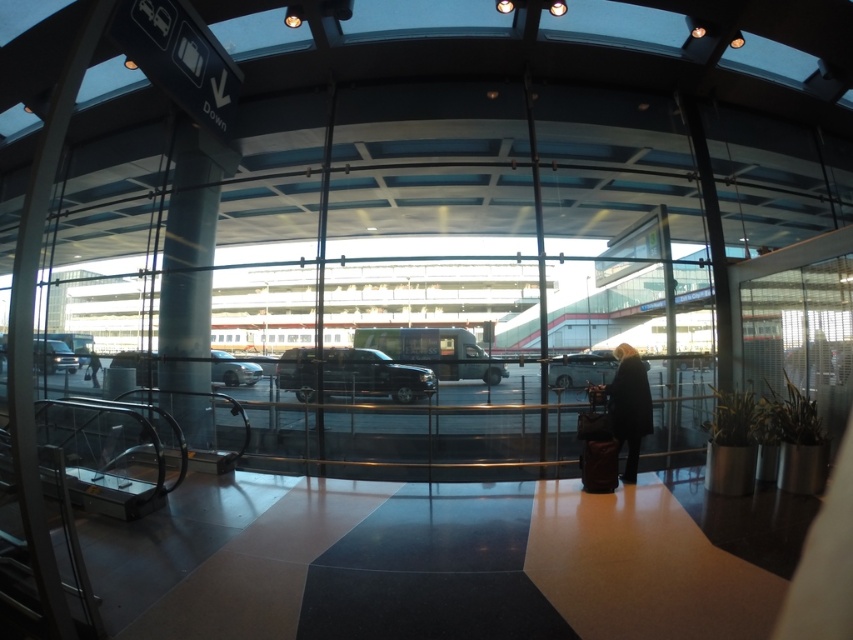
How far apart are metallic silver van at center and metallic silver van at left?

metallic silver van at center is 36.23 feet away from metallic silver van at left.

Does metallic silver van at center have a larger size compared to metallic silver van at left?

Indeed, metallic silver van at center has a larger size compared to metallic silver van at left.

Locate an element on the screen. Image resolution: width=853 pixels, height=640 pixels. metallic silver van at center is located at coordinates (582, 369).

Locate an element on the screen. metallic silver van at center is located at coordinates (582, 369).

Does dark brown leather suitcase at lower right appear on the right side of matte black suitcase at center?

Yes, dark brown leather suitcase at lower right is to the right of matte black suitcase at center.

Does point (640, 385) lie behind point (589, 480)?

That is True.

The height and width of the screenshot is (640, 853). In order to click on dark brown leather suitcase at lower right in this screenshot , I will do `click(630, 404)`.

From the picture: Is matte black suitcase at center positioned before metallic silver van at left?

Yes, matte black suitcase at center is in front of metallic silver van at left.

Can you confirm if matte black suitcase at center is smaller than metallic silver van at left?

Yes, matte black suitcase at center is smaller than metallic silver van at left.

Does point (583, 464) come in front of point (68, 372)?

Yes, point (583, 464) is in front of point (68, 372).

Identify the location of matte black suitcase at center. (596, 445).